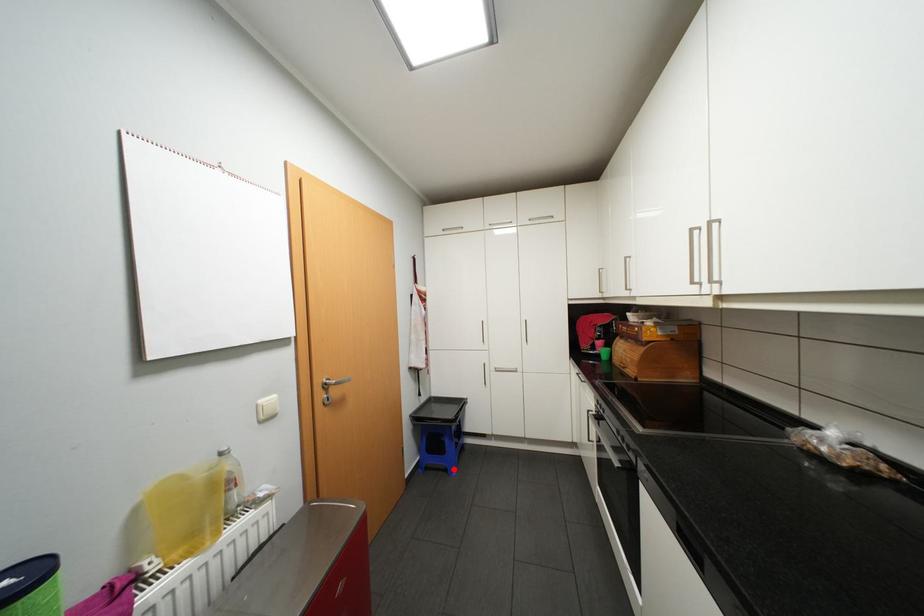
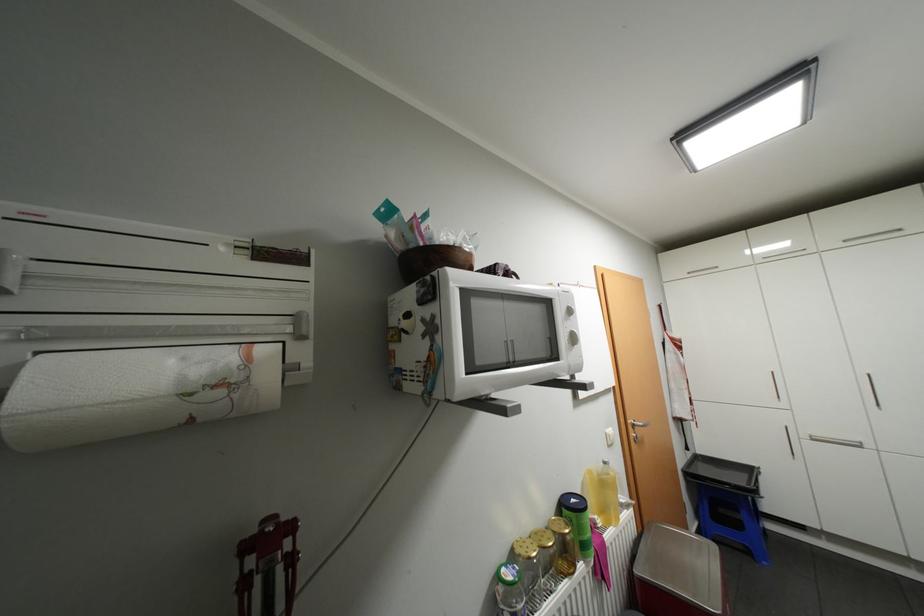
Locate, in the second image, the point that corresponds to the highlighted location in the first image.

(756, 552)